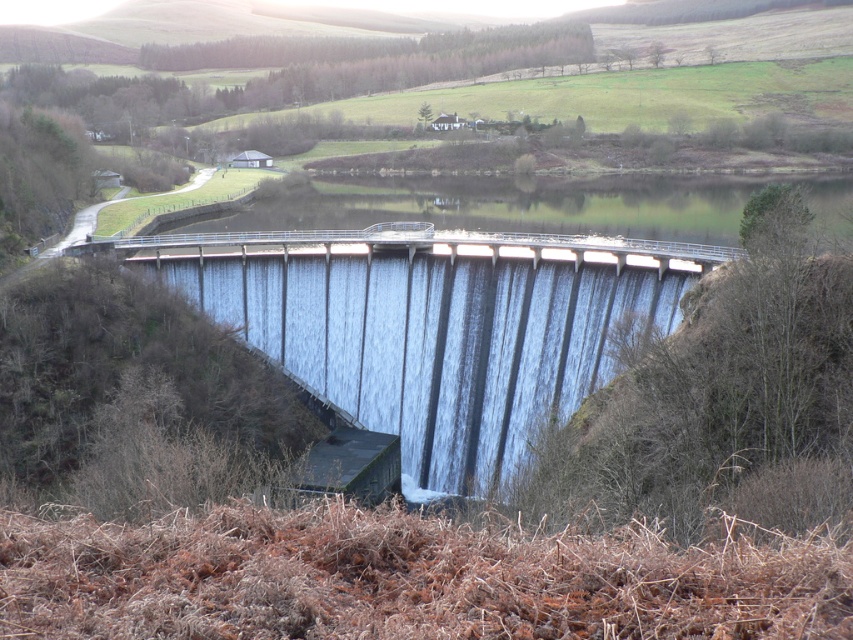
Question: Does smooth concrete dam at center appear under clear water at center?

Choices:
 (A) no
 (B) yes

Answer: (B)

Question: Which object appears farthest from the camera in this image?

Choices:
 (A) smooth concrete dam at center
 (B) clear water at center

Answer: (B)

Question: Is smooth concrete dam at center positioned at the back of clear water at center?

Choices:
 (A) yes
 (B) no

Answer: (B)

Question: Among these points, which one is farthest from the camera?

Choices:
 (A) (495, 314)
 (B) (549, 232)

Answer: (B)

Question: Is the position of smooth concrete dam at center less distant than that of clear water at center?

Choices:
 (A) no
 (B) yes

Answer: (B)